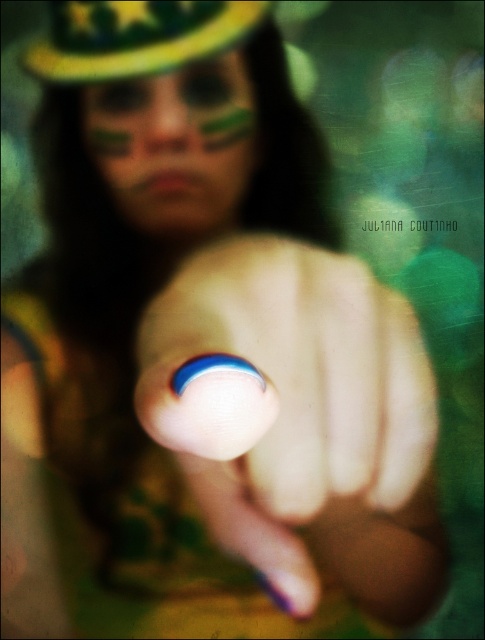
You are an artist analyzing the image. You notice the blue painted nail at center and the matte green paint at center. Which object has a greater width?

The blue painted nail at center has a greater width than the matte green paint at center since its width surpasses the latter.

You are a photographer trying to focus on the blue painted nail at center. According to the coordinates provided, where exactly should you adjust your camera focus to capture it perfectly?

To capture the blue painted nail at center perfectly, adjust your camera focus to the coordinates point at (x=300, y=419).